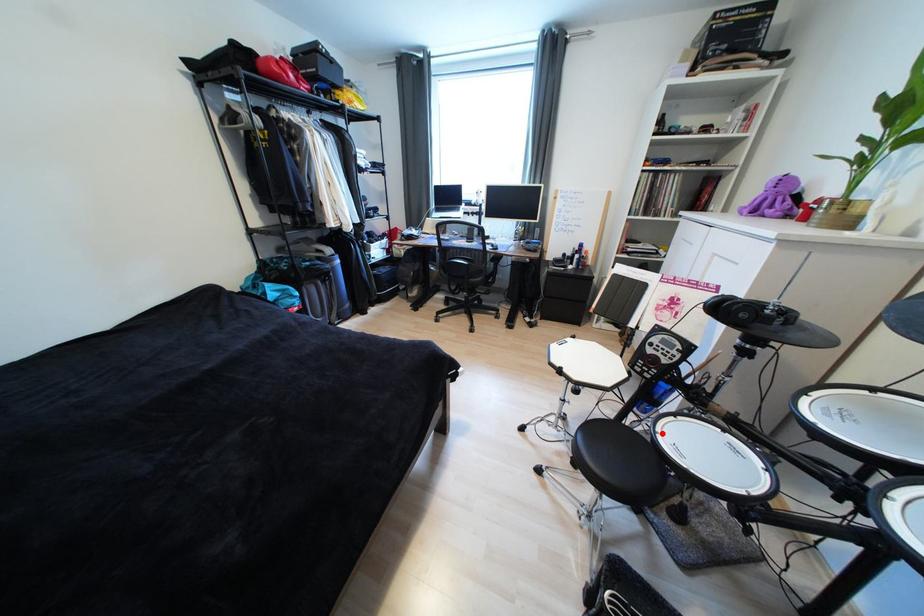
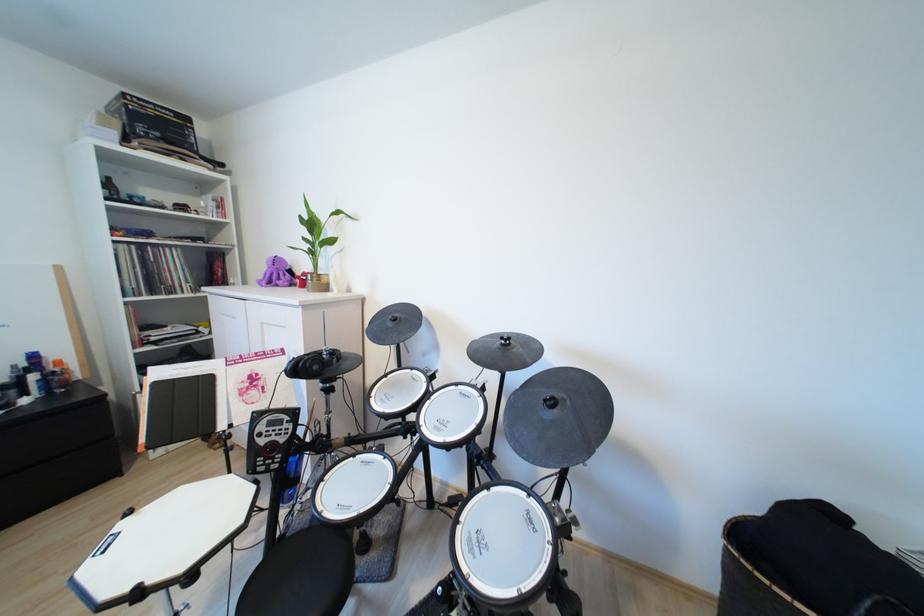
Locate, in the second image, the point that corresponds to the highlighted location in the first image.

(326, 515)